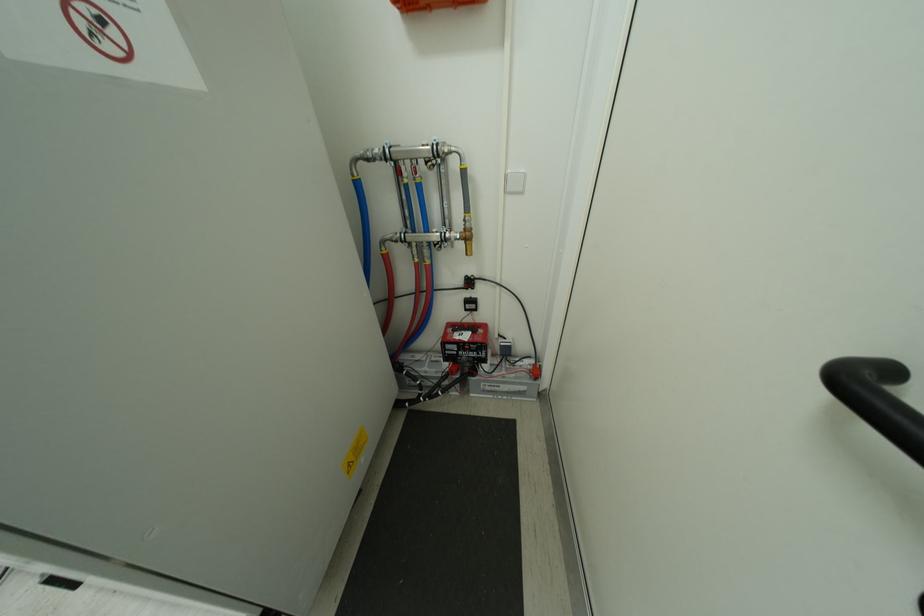
Identify the location of black door handle. The image size is (924, 616). (878, 403).